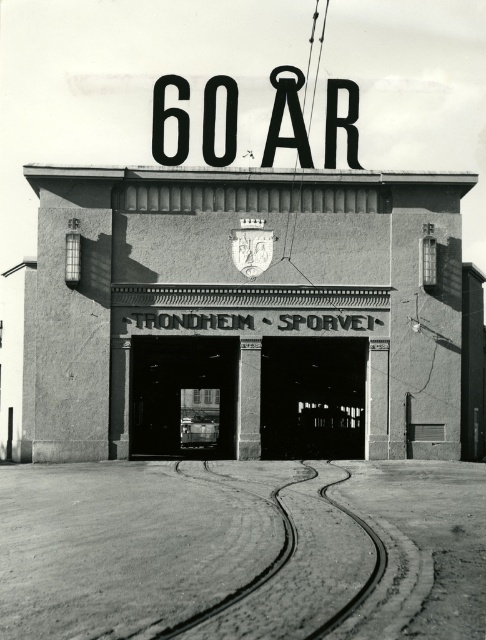
Based on the photo, you are standing in front of the tram depot and want to locate both the concrete textured building at center and the black metal sign at upper center. According to the scene, which object is positioned to the left of the other?

The concrete textured building at center is to the left of black metal sign at upper center.

You are standing at the tram depot depicted in the image. If you were to walk directly towards the point marked at coordinates (x=245, y=305), what structure would you be approaching?

The point at coordinates (x=245, y=305) corresponds to the concrete textured building at center, so you would be approaching the concrete textured building at center.

You are standing in front of the tram depot depicted in the image. You want to place a new decorative plaque on the wall between the concrete textured building at center and the black metal sign at upper center. The plaque requires 10 feet of space between it and both objects. Is there enough space for this placement?

The concrete textured building at center is 19.14 feet away from the black metal sign at upper center. Since the required space is 10 feet between the plaque and both objects, the total needed space would be 20 feet. However, the distance between them is only 19.14 feet, so there isn not enough space for the plaque placement.